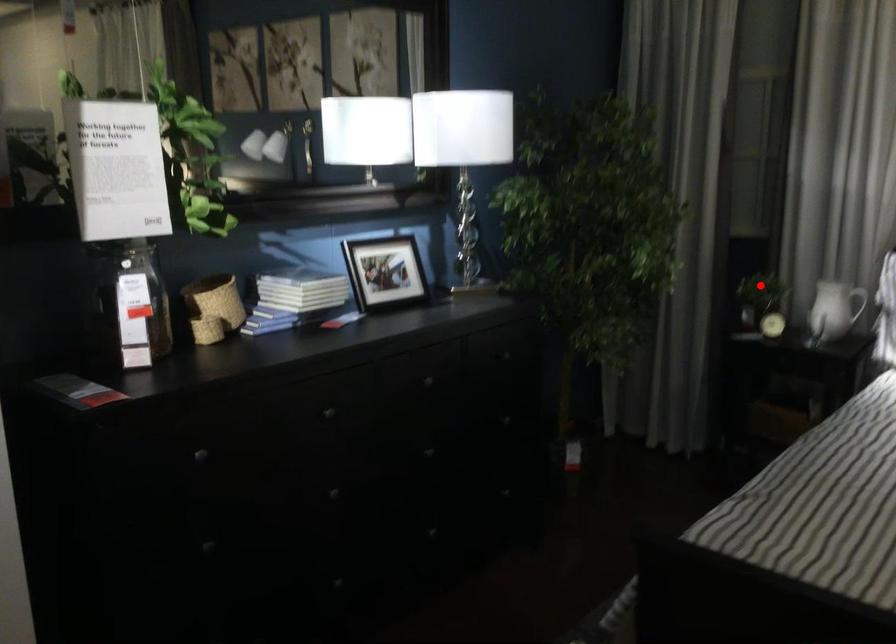
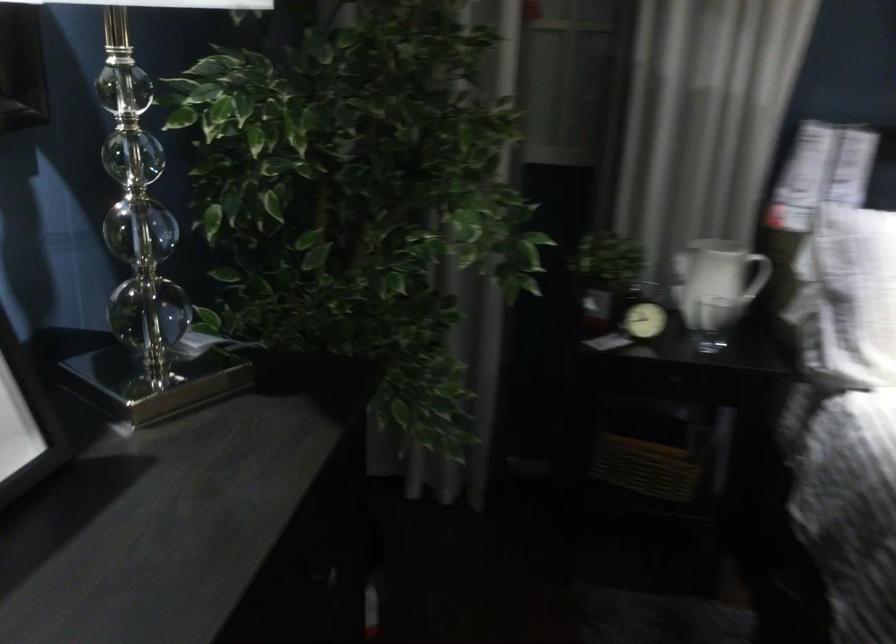
Where in the second image is the point corresponding to the highlighted location from the first image?

(605, 275)